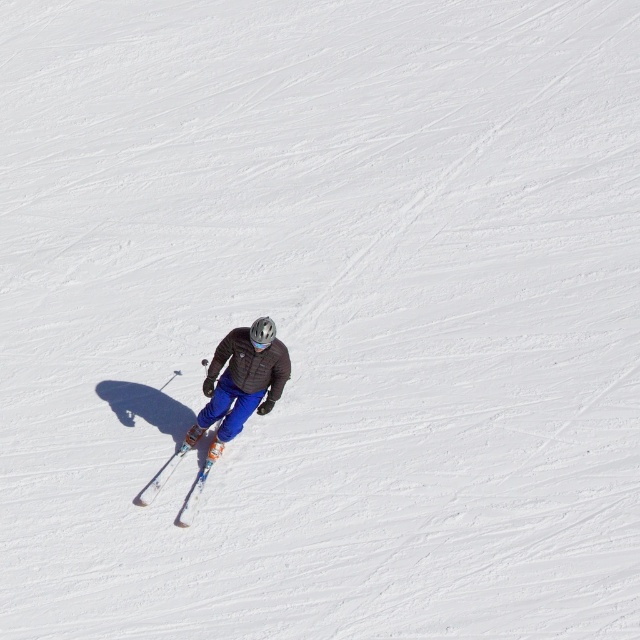
Does point (218, 368) come behind point (189, 515)?

No, it is not.

Does matte blue ski pants at center lie in front of white plastic ski at center?

Yes, it is.

Where is `matte blue ski pants at center`? matte blue ski pants at center is located at coordinates (241, 381).